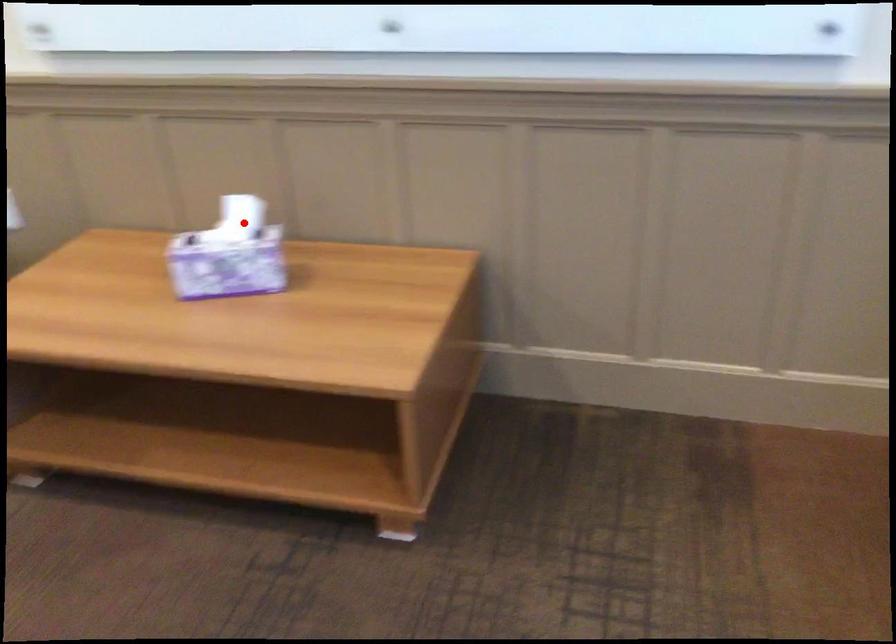
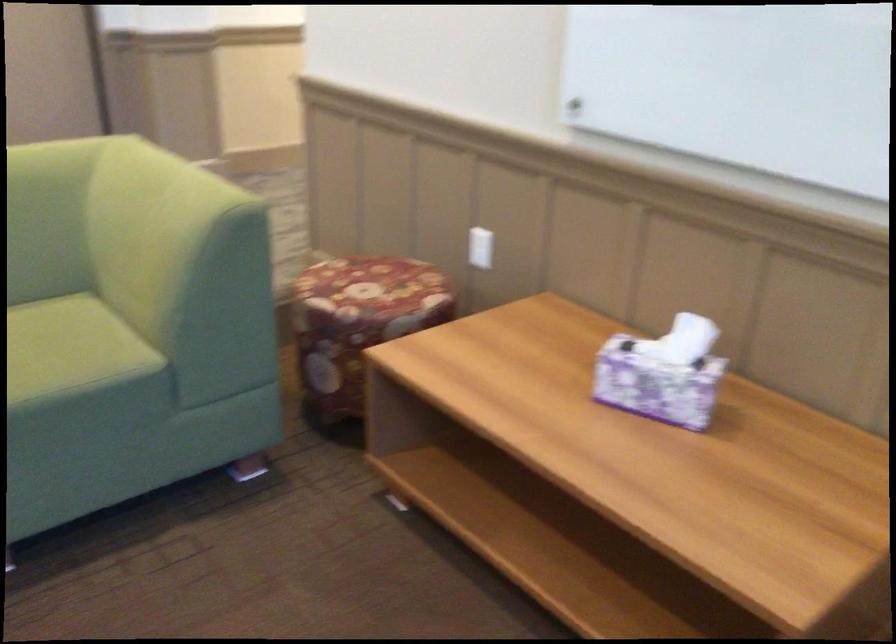
Where in the second image is the point corresponding to the highlighted location from the first image?

(690, 341)